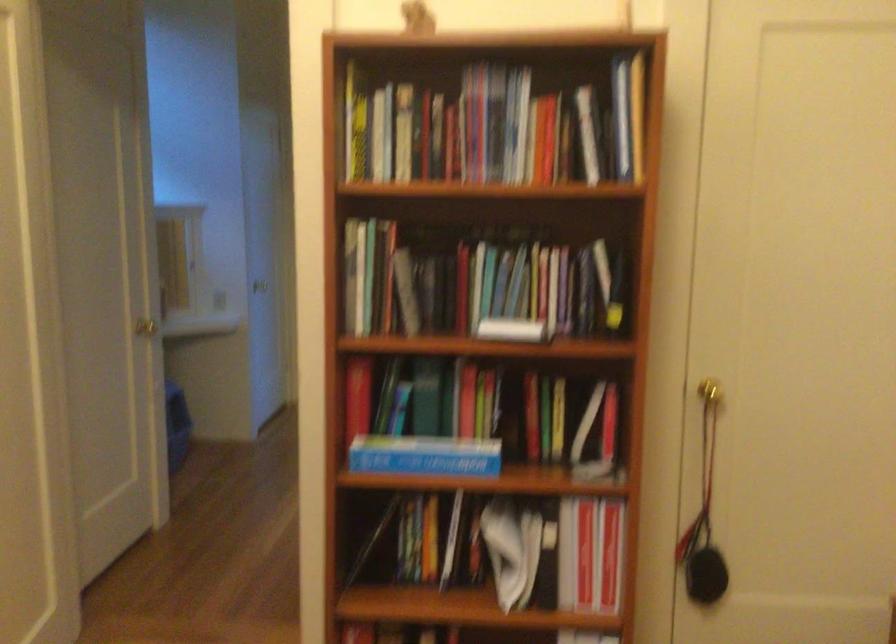
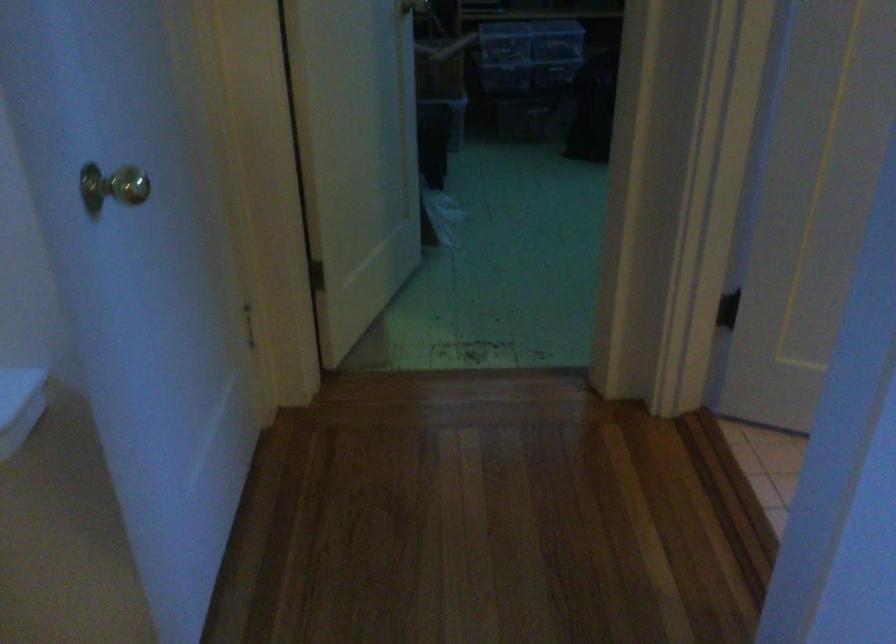
Question: In a continuous first-person perspective shot, in which direction is the camera moving?

Choices:
 (A) Left
 (B) Right
 (C) Forward
 (D) Backward

Answer: (C)